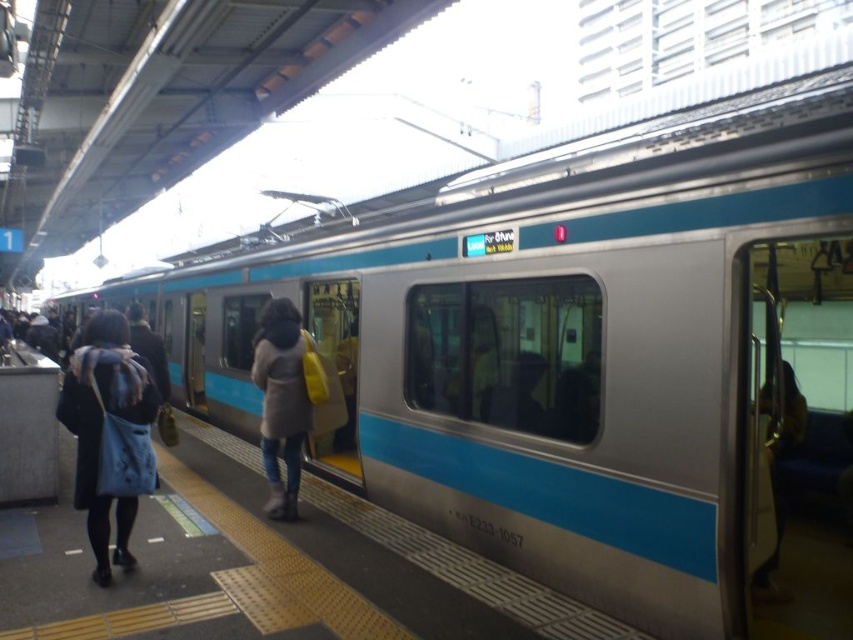
Based on the photo, you are a passenger on the platform and want to know which coat is wider between the black fabric coat at left and the light brown leather coat at center. Can you tell me?

The black fabric coat at left is wider than the light brown leather coat at center according to the description.